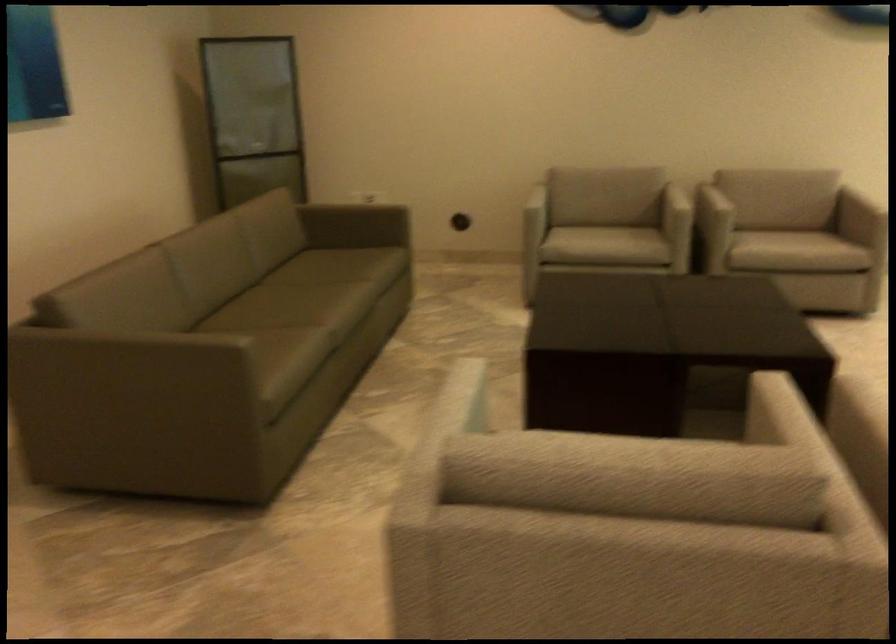
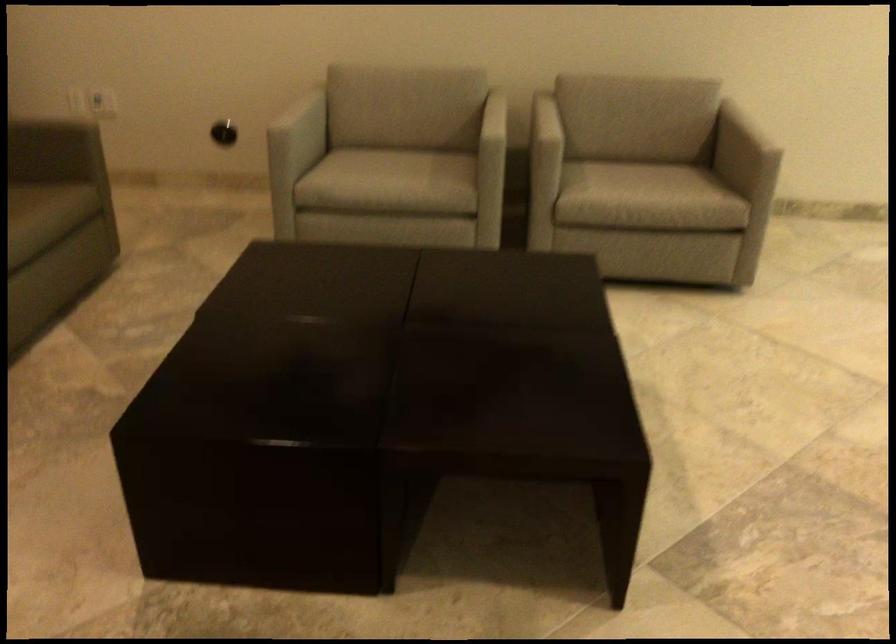
Locate, in the second image, the point that corresponds to (532,205) in the first image.

(304, 124)